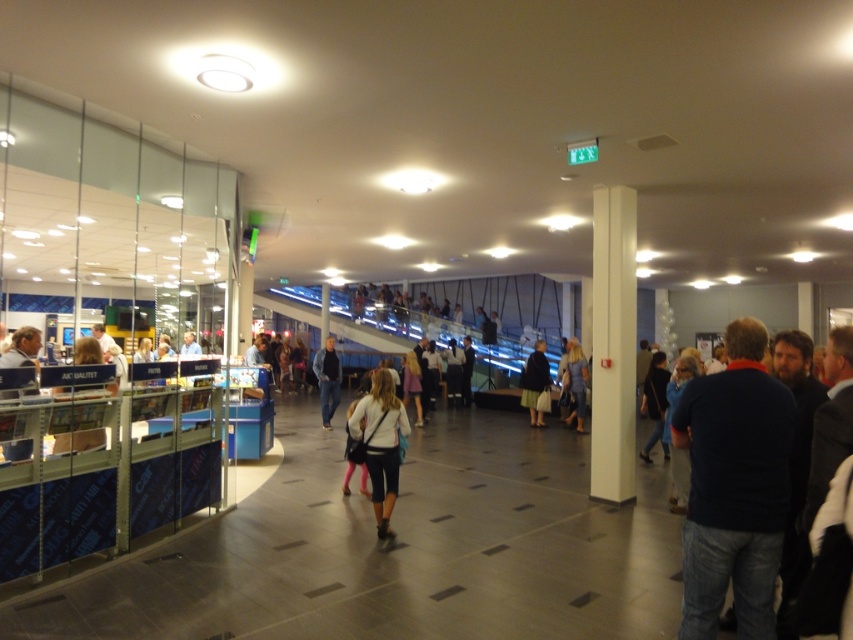
Question: Which point is closer to the camera?

Choices:
 (A) (585, 369)
 (B) (749, 410)
 (C) (316, 362)
 (D) (376, 416)

Answer: (B)

Question: Which of the following is the farthest from the observer?

Choices:
 (A) dark gray fabric coat at center
 (B) light brown leather jacket at center
 (C) denim jeans at center
 (D) dark blue shirt at center-right

Answer: (A)

Question: Which object is the farthest from the dark gray fabric coat at center?

Choices:
 (A) dark blue shirt at center-right
 (B) light brown leather jacket at center
 (C) denim jeans at center
 (D) white matte shirt at center

Answer: (A)

Question: Considering the relative positions of dark blue shirt at center-right and white matte shirt at center in the image provided, where is dark blue shirt at center-right located with respect to white matte shirt at center?

Choices:
 (A) left
 (B) right

Answer: (B)

Question: Is white matte shirt at center bigger than light brown leather jacket at center?

Choices:
 (A) yes
 (B) no

Answer: (B)

Question: Is white matte shirt at center further to camera compared to light brown leather jacket at center?

Choices:
 (A) no
 (B) yes

Answer: (A)